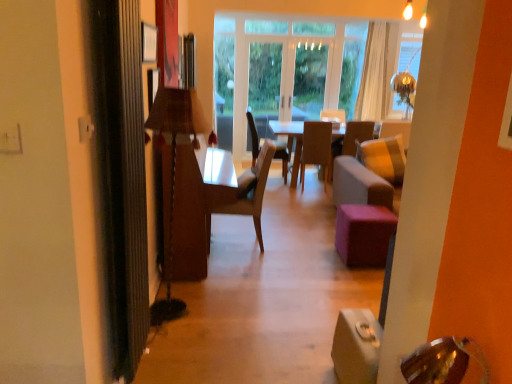
Locate an element on the screen. vacant area situated to the left side of purple fabric stool at center is located at coordinates (318, 251).